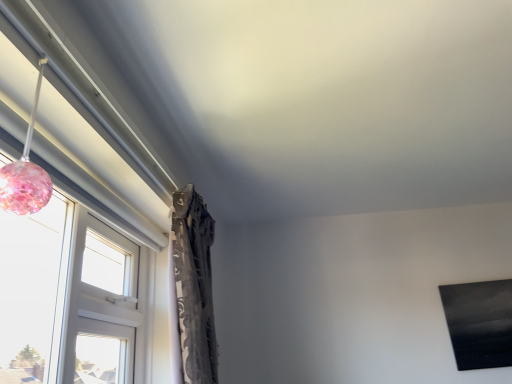
Question: Considering the relative positions of translucent pink glass sphere at left and transparent glass window at left in the image provided, is translucent pink glass sphere at left to the left or to the right of transparent glass window at left?

Choices:
 (A) right
 (B) left

Answer: (B)

Question: Based on their sizes in the image, would you say translucent pink glass sphere at left is bigger or smaller than transparent glass window at left?

Choices:
 (A) big
 (B) small

Answer: (B)

Question: Considering the positions of point tap(6, 177) and point tap(69, 334), is point tap(6, 177) closer or farther from the camera than point tap(69, 334)?

Choices:
 (A) farther
 (B) closer

Answer: (B)

Question: Is transparent glass window at left inside the boundaries of translucent pink glass sphere at left, or outside?

Choices:
 (A) outside
 (B) inside

Answer: (A)

Question: From the image's perspective, relative to translucent pink glass sphere at left, is transparent glass window at left above or below?

Choices:
 (A) above
 (B) below

Answer: (B)

Question: In the image, is transparent glass window at left on the left side or the right side of translucent pink glass sphere at left?

Choices:
 (A) right
 (B) left

Answer: (A)

Question: Is point (16, 299) closer or farther from the camera than point (10, 205)?

Choices:
 (A) closer
 (B) farther

Answer: (B)